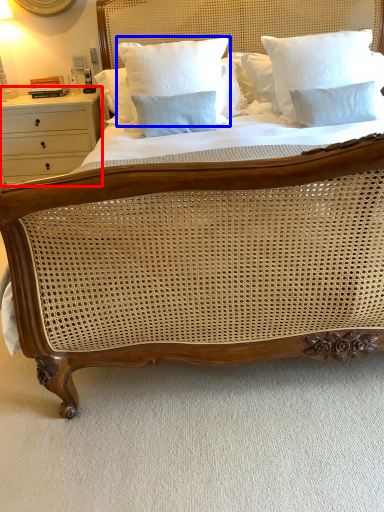
Question: Which object appears closest to the camera in this image, nightstand (highlighted by a red box) or pillow (highlighted by a blue box)?

Choices:
 (A) nightstand
 (B) pillow

Answer: (B)